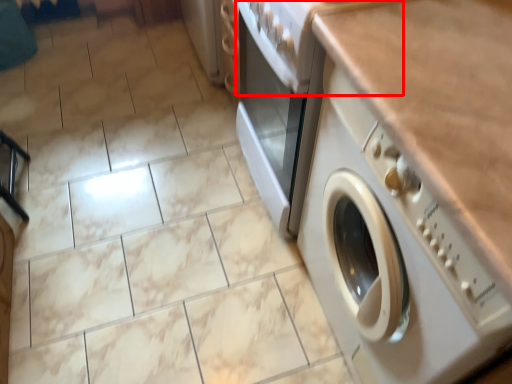
Question: From the image's perspective, what is the correct spatial positioning of gas stove (annotated by the red box) in reference to washing machine?

Choices:
 (A) below
 (B) above

Answer: (B)